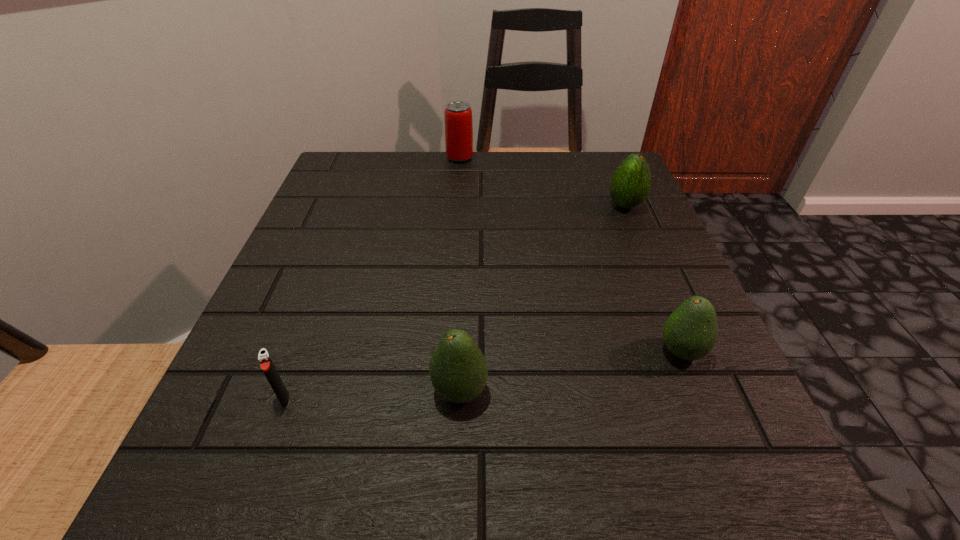
Where is `beer can`? beer can is located at coordinates (458, 115).

Locate an element on the screen. Image resolution: width=960 pixels, height=540 pixels. the farthest avocado is located at coordinates (630, 184).

Find the location of a particular element. Image resolution: width=960 pixels, height=540 pixels. the leftmost avocado is located at coordinates (458, 370).

You are a GUI agent. You are given a task and a screenshot of the screen. Output one action in this format:
    pyautogui.click(x=<x>, y=<y>)
    Task: Click on the igniter
    The image size is (960, 540).
    Given the screenshot: What is the action you would take?
    pyautogui.click(x=266, y=364)

Where is `vacant space located 0.190m on the right of the beer can`? This screenshot has height=540, width=960. vacant space located 0.190m on the right of the beer can is located at coordinates (550, 158).

You are a GUI agent. You are given a task and a screenshot of the screen. Output one action in this format:
    pyautogui.click(x=<x>, y=<y>)
    Task: Click on the free space located on the front of the farthest avocado
    Image resolution: width=960 pixels, height=540 pixels.
    Given the screenshot: What is the action you would take?
    pyautogui.click(x=686, y=348)

Where is `free location located on the right of the leftmost avocado`? This screenshot has width=960, height=540. free location located on the right of the leftmost avocado is located at coordinates 618,391.

The image size is (960, 540). Identify the location of vacant space positioned 0.280m on the back of the igniter. (336, 257).

The image size is (960, 540). I want to click on beer can at the far edge, so click(x=458, y=115).

The image size is (960, 540). In order to click on avocado located at the far edge in this screenshot , I will do `click(630, 184)`.